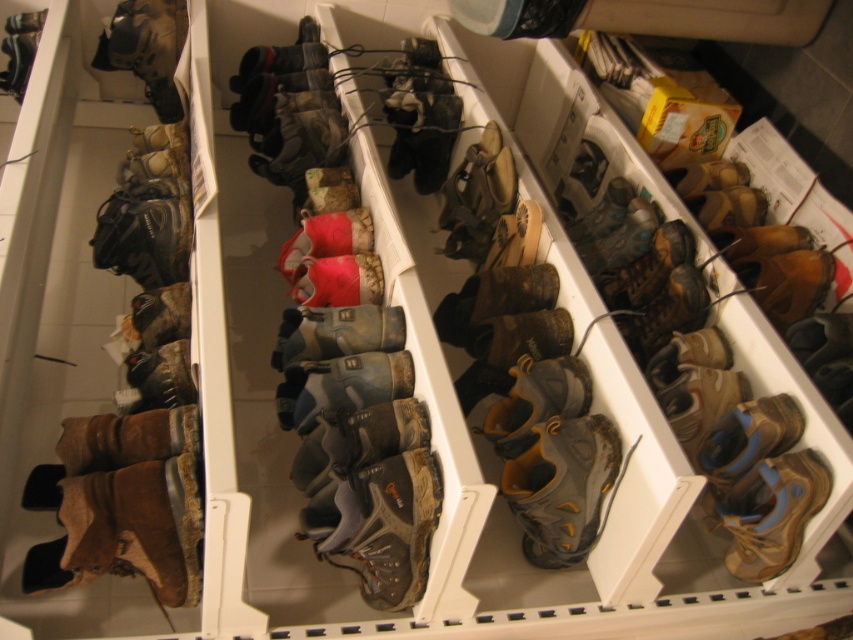
Question: Which object is farther from the camera taking this photo?

Choices:
 (A) brown suede boots at left
 (B) gray suede boot at center
 (C) brown suede boot at center

Answer: (B)

Question: Can you confirm if brown suede boot at center is thinner than tan suede boot at lower right?

Choices:
 (A) no
 (B) yes

Answer: (A)

Question: From the image, what is the correct spatial relationship of brown suede boot at center in relation to gray suede boot at center?

Choices:
 (A) right
 (B) left

Answer: (B)

Question: Which of the following is the closest to the observer?

Choices:
 (A) (561, 541)
 (B) (775, 548)

Answer: (B)

Question: Does brown suede boots at left appear over gray suede boot at center?

Choices:
 (A) no
 (B) yes

Answer: (B)

Question: Which object is farther from the camera taking this photo?

Choices:
 (A) gray suede boot at center
 (B) brown suede boot at center

Answer: (A)